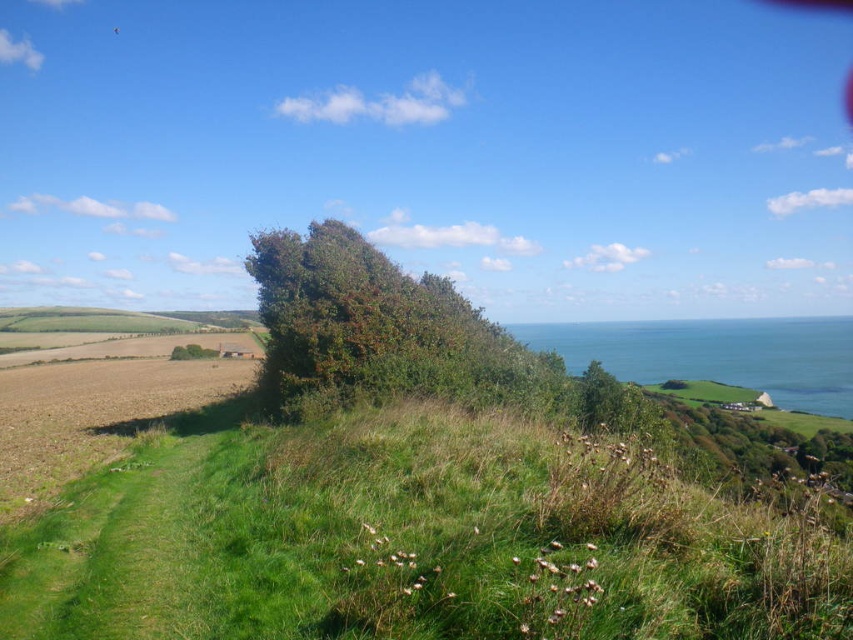
You are standing at the top of the green grassy hillside at center and want to reach the green leafy bush at center. Which direction should you move to get there?

The green leafy bush at center is above the green grassy hillside at center, so you should move upwards to reach it.